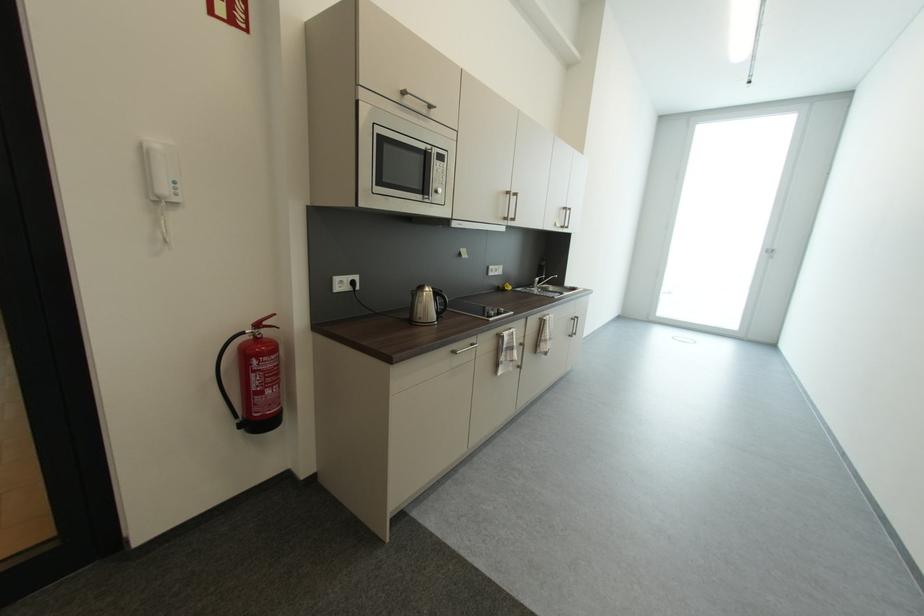
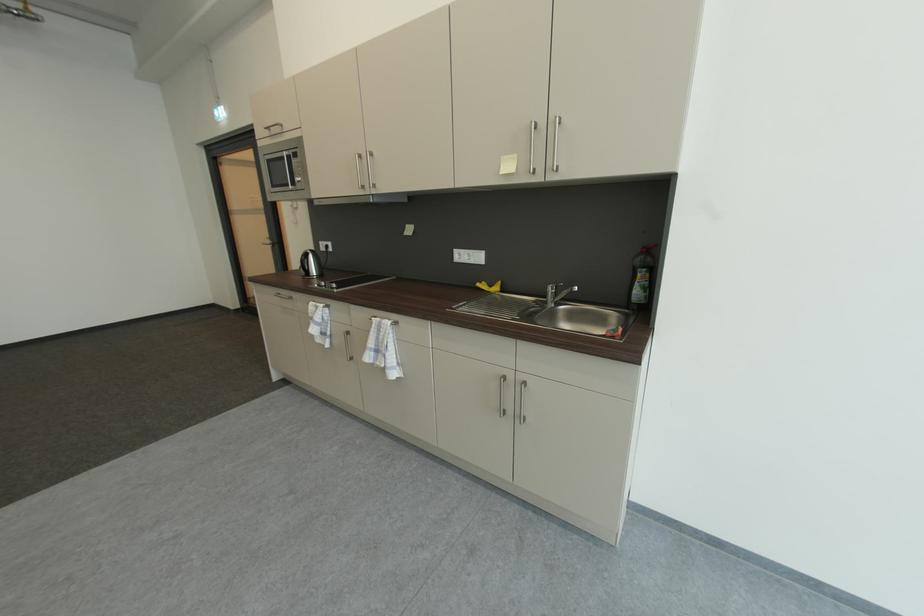
Locate, in the second image, the point that corresponds to point 505,288 in the first image.

(487, 284)